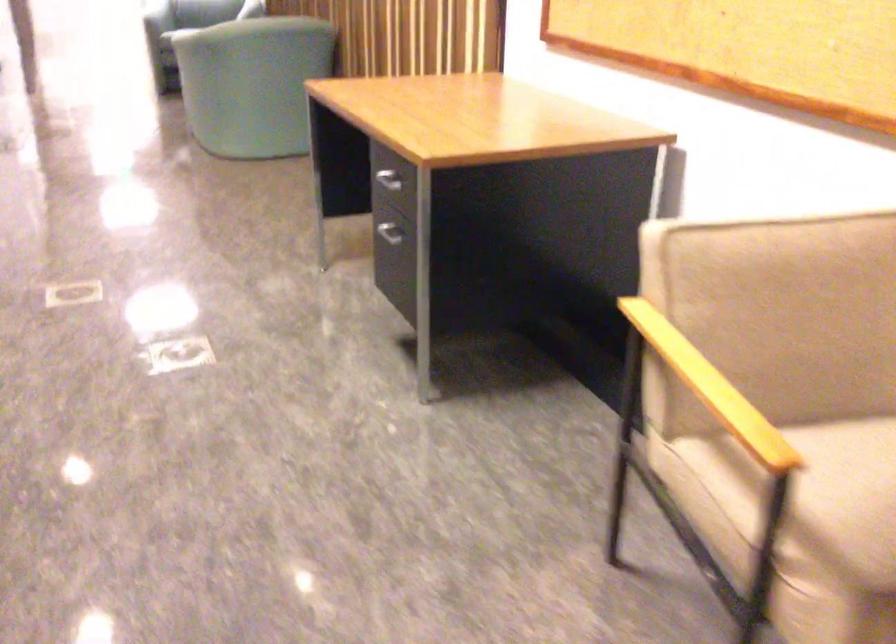
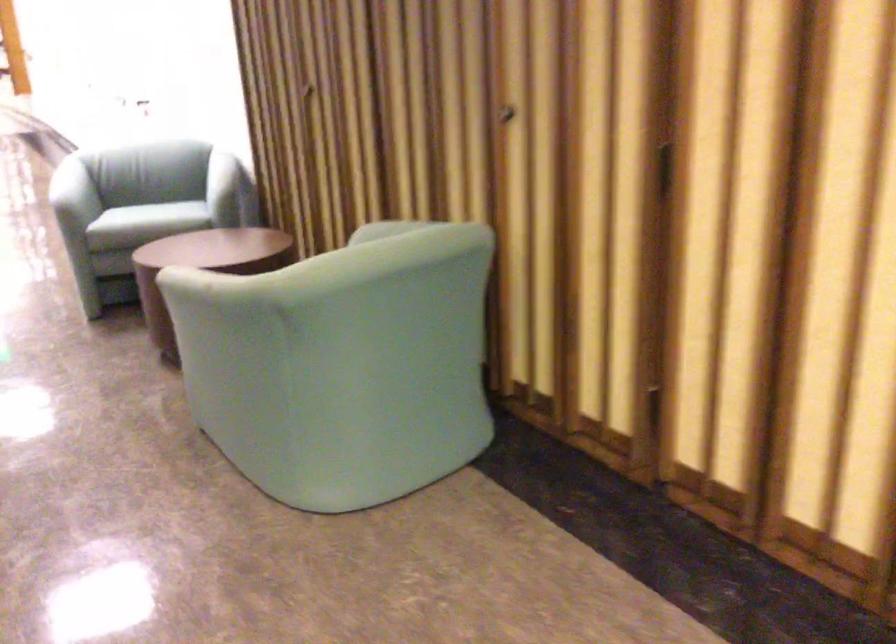
In a continuous first-person perspective shot, in which direction is the camera moving?

The movement direction of the cameraman is left, forward.